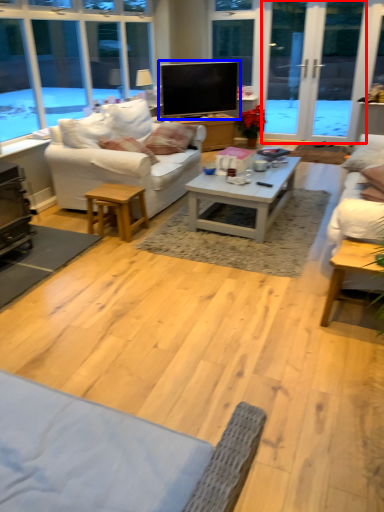
Question: Which of the following is the farthest to the observer, screen door (highlighted by a red box) or television (highlighted by a blue box)?

Choices:
 (A) screen door
 (B) television

Answer: (B)